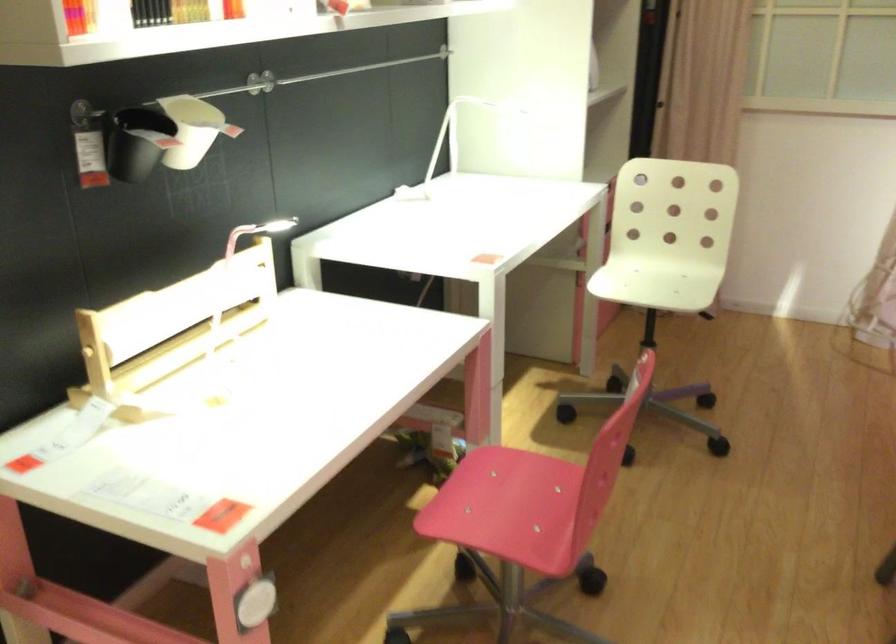
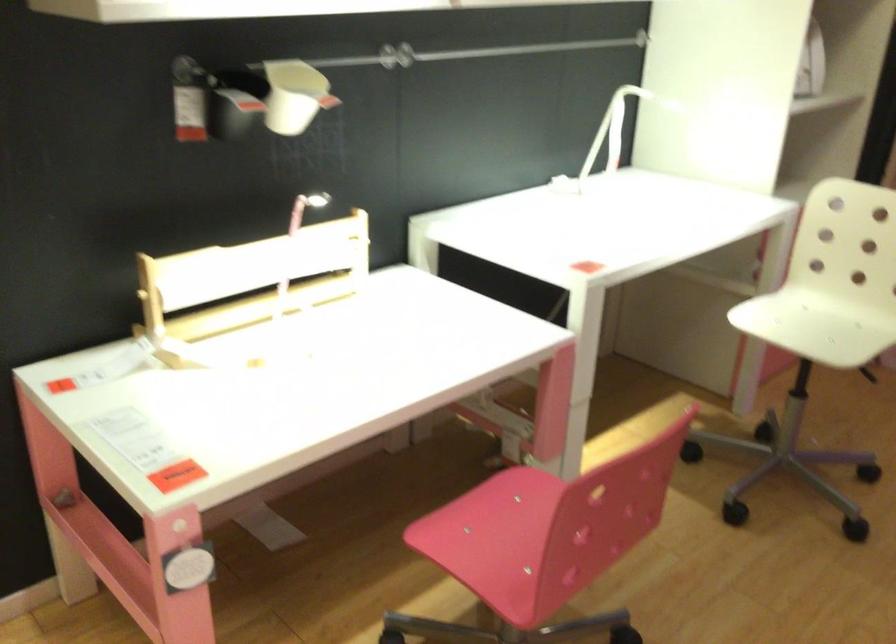
Locate, in the second image, the point that corresponds to point (203, 129) in the first image.

(295, 96)